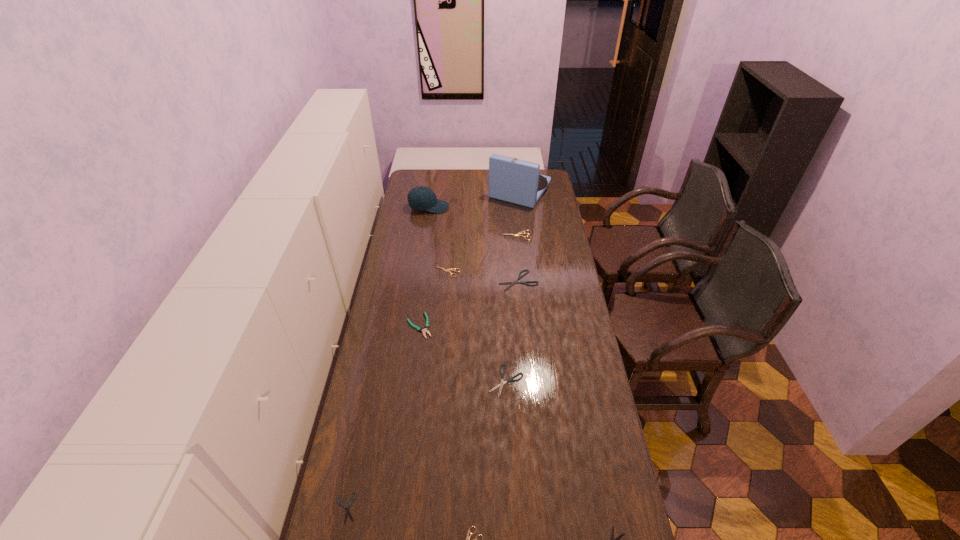
The width and height of the screenshot is (960, 540). Find the location of `free space at the left edge of the desktop`. free space at the left edge of the desktop is located at coordinates (378, 392).

Where is `vacant point at the right edge`? vacant point at the right edge is located at coordinates (588, 381).

At what (x,y) coordinates should I click in order to perform the action: click on free space between the ninth shortest object and the leftmost shears. Please return your answer as a coordinate pair (x, y). The image size is (960, 540). Looking at the image, I should click on (387, 358).

You are a GUI agent. You are given a task and a screenshot of the screen. Output one action in this format:
    pyautogui.click(x=<x>, y=<y>)
    Task: Click on the vacant space that's between the blue baseball cap and the phonograph record
    
    Given the screenshot: What is the action you would take?
    pyautogui.click(x=474, y=199)

Locate an element on the screen. The height and width of the screenshot is (540, 960). free point between the leftmost black shears and the leftmost beige shears is located at coordinates (396, 390).

Identify the location of free space between the teal pliers and the seventh shortest object. (468, 281).

Where is `the ninth closest object to the baseball cap`? The height and width of the screenshot is (540, 960). the ninth closest object to the baseball cap is located at coordinates (612, 535).

The height and width of the screenshot is (540, 960). In order to click on object that stands as the third closest to the farthest beige shears in this screenshot , I will do `click(451, 269)`.

Locate an element on the screen. the third closest shears to the blue baseball cap is located at coordinates (512, 283).

Locate an element on the screen. shears that is the fourth nearest to the biggest black shears is located at coordinates (612, 535).